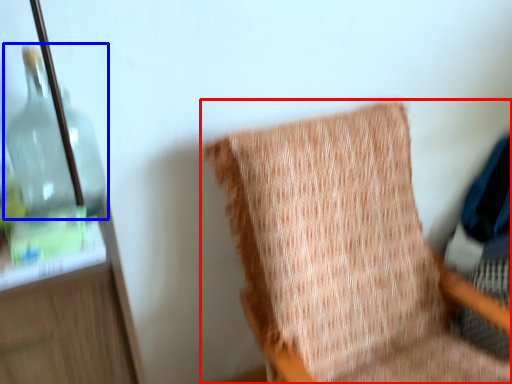
Question: Which object is further to the camera taking this photo, chair (highlighted by a red box) or bottle (highlighted by a blue box)?

Choices:
 (A) chair
 (B) bottle

Answer: (B)